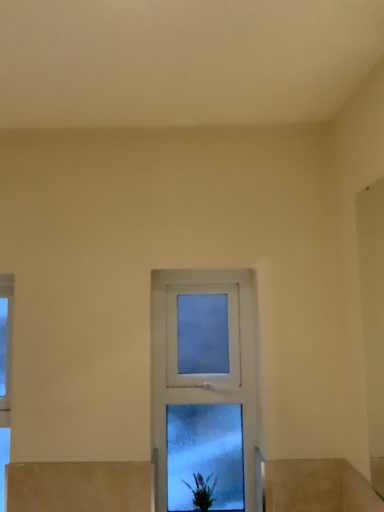
Question: From a real-world perspective, is green matte plant at lower center physically located above or below clear glass window at center?

Choices:
 (A) below
 (B) above

Answer: (A)

Question: Is point (193, 497) positioned closer to the camera than point (236, 285)?

Choices:
 (A) farther
 (B) closer

Answer: (B)

Question: Visually, is green matte plant at lower center positioned to the left or to the right of clear glass window at center?

Choices:
 (A) left
 (B) right

Answer: (A)

Question: Considering their positions, is clear glass window at center located in front of or behind green matte plant at lower center?

Choices:
 (A) front
 (B) behind

Answer: (B)

Question: Is point (230, 455) closer or farther from the camera than point (200, 479)?

Choices:
 (A) farther
 (B) closer

Answer: (A)

Question: From the image's perspective, is clear glass window at center located above or below green matte plant at lower center?

Choices:
 (A) above
 (B) below

Answer: (A)

Question: Would you say clear glass window at center is inside or outside green matte plant at lower center?

Choices:
 (A) outside
 (B) inside

Answer: (A)